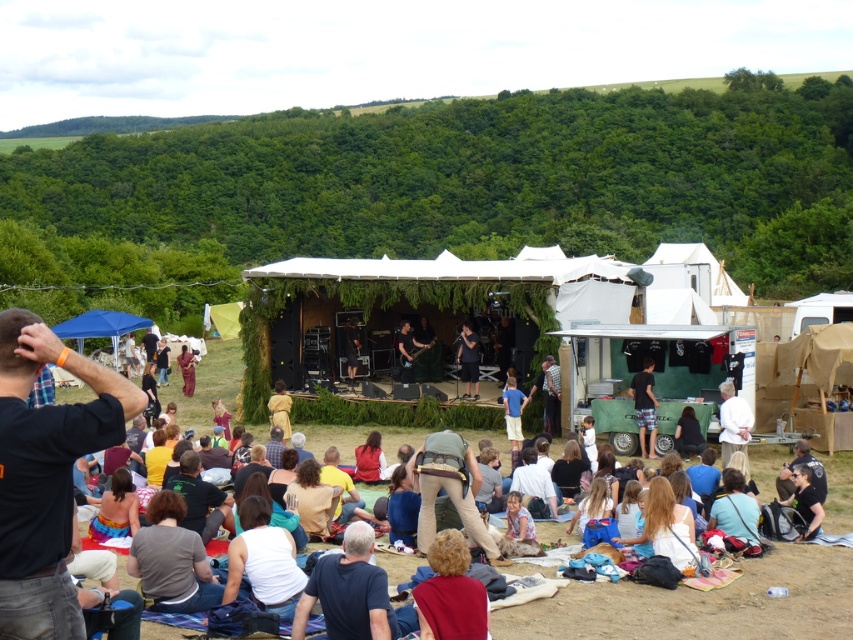
Who is positioned more to the left, plaid shorts at center or brown fabric dress at center?

From the viewer's perspective, brown fabric dress at center appears more on the left side.

From the picture: Is plaid shorts at center smaller than brown fabric dress at center?

Indeed, plaid shorts at center has a smaller size compared to brown fabric dress at center.

The width and height of the screenshot is (853, 640). I want to click on plaid shorts at center, so click(643, 404).

Where is `plaid shorts at center`? plaid shorts at center is located at coordinates (643, 404).

Who is higher up, plaid shorts at center or dark brown leather guitar at center?

dark brown leather guitar at center is higher up.

Can you confirm if plaid shorts at center is taller than dark brown leather guitar at center?

Correct, plaid shorts at center is much taller as dark brown leather guitar at center.

Who is more forward, (x=639, y=436) or (x=347, y=328)?

Point (x=639, y=436) is in front.

The image size is (853, 640). I want to click on plaid shorts at center, so click(x=643, y=404).

Does black cotton shirt at lower left appear over brown fabric dress at center?

Incorrect, black cotton shirt at lower left is not positioned above brown fabric dress at center.

Which is behind, point (19, 348) or point (190, 364)?

Positioned behind is point (190, 364).

Which is in front, point (12, 348) or point (178, 358)?

Point (12, 348) is more forward.

Where is `black cotton shirt at lower left`? black cotton shirt at lower left is located at coordinates (45, 474).